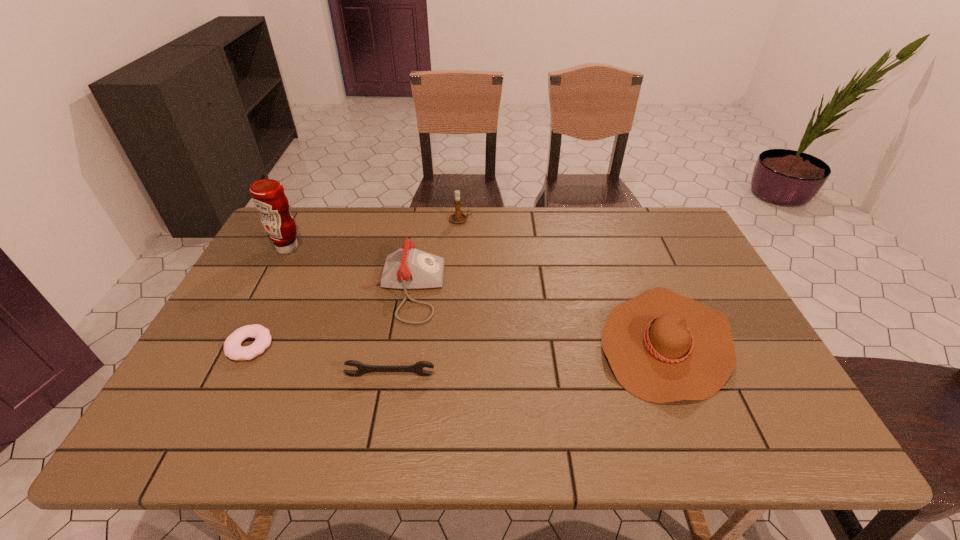
In order to click on vacant space in between the second shortest object and the candle holder in this screenshot , I will do `click(425, 298)`.

I want to click on free area in between the doughnut and the tallest object, so click(x=269, y=297).

Locate an element on the screen. Image resolution: width=960 pixels, height=540 pixels. empty space between the telephone and the wrench is located at coordinates (396, 332).

This screenshot has height=540, width=960. What are the coordinates of `vacant point located between the fourth tallest object and the candle holder` in the screenshot? It's located at (564, 281).

The height and width of the screenshot is (540, 960). I want to click on object that can be found as the closest to the tallest object, so click(x=408, y=268).

Find the location of a particular element. The height and width of the screenshot is (540, 960). the third closest object to the second shortest object is located at coordinates (662, 347).

At what (x,y) coordinates should I click in order to perform the action: click on free point that satisfies the following two spatial constraints: 1. on the dial of the telephone; 2. on the front side of the shortest object. Please return your answer as a coordinate pair (x, y). The height and width of the screenshot is (540, 960). Looking at the image, I should click on tap(393, 346).